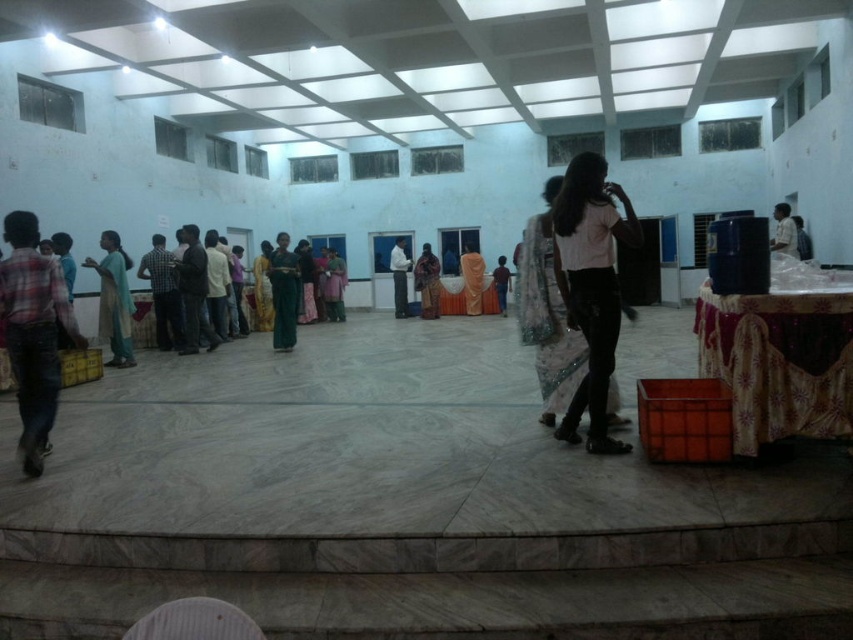
Question: Does white glossy shirt at center appear under dark blue shirt at center?

Choices:
 (A) yes
 (B) no

Answer: (A)

Question: Which point is farther to the camera?

Choices:
 (A) tap(576, 337)
 (B) tap(770, 244)
 (C) tap(393, 300)

Answer: (C)

Question: Does white glossy shirt at center have a greater width compared to dark blue shirt at center?

Choices:
 (A) yes
 (B) no

Answer: (B)

Question: Which object is farther from the camera taking this photo?

Choices:
 (A) white lace saree at center
 (B) dark blue shirt at center

Answer: (B)

Question: Which object is closer to the camera taking this photo?

Choices:
 (A) dark blue shirt at center
 (B) white lace saree at center

Answer: (B)

Question: Does white lace saree at center have a greater width compared to dark blue shirt at center?

Choices:
 (A) yes
 (B) no

Answer: (B)